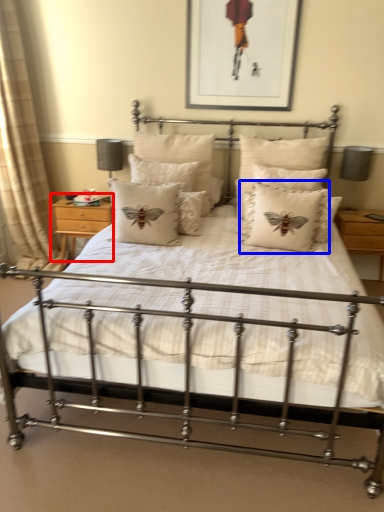
Question: Among these objects, which one is farthest to the camera, nightstand (highlighted by a red box) or pillow (highlighted by a blue box)?

Choices:
 (A) nightstand
 (B) pillow

Answer: (A)